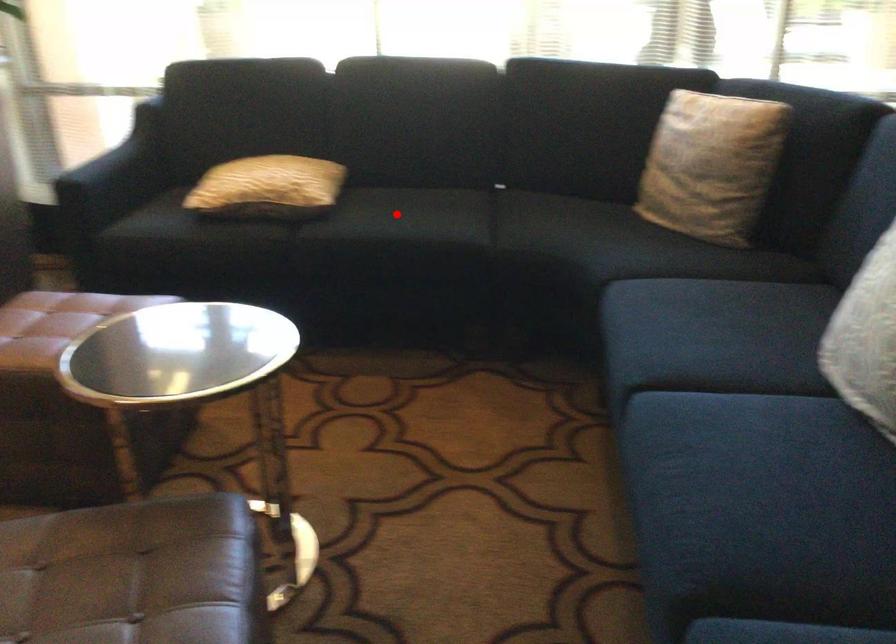
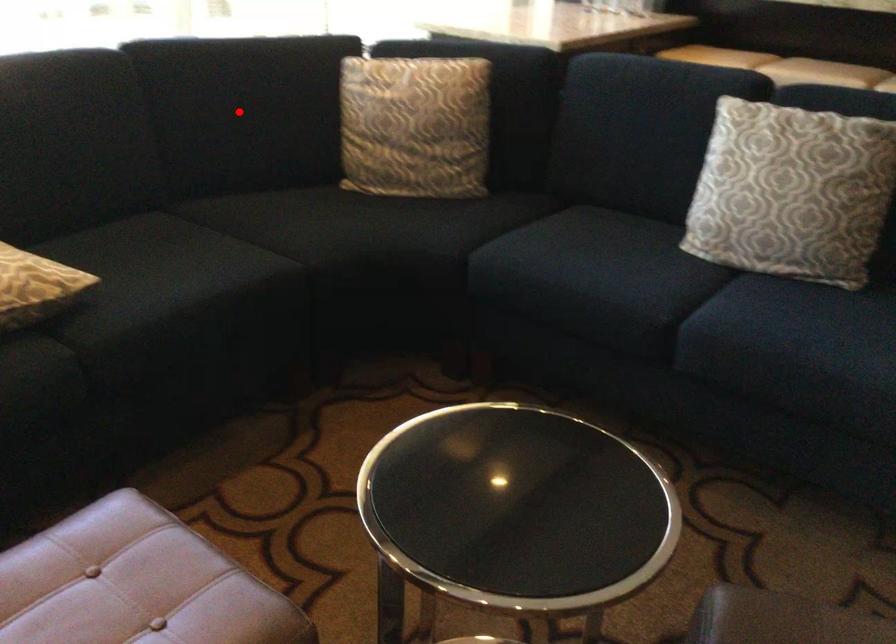
I am providing you with two images of the same scene from different viewpoints. A red point is marked on the first image and another point is marked on the second image. Does the point marked in image1 correspond to the same location as the one in image2?

No